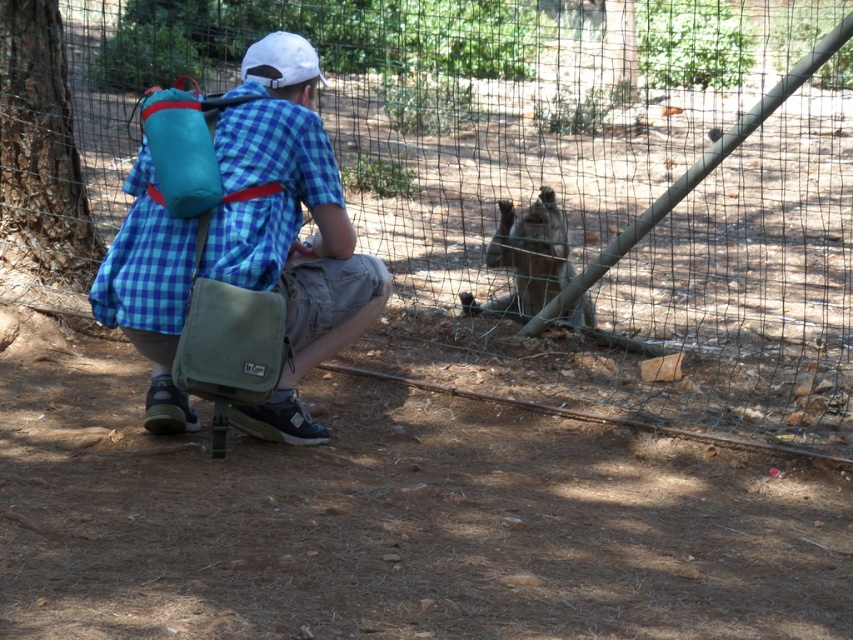
Is green mesh fence at center smaller than green canvas bag at center?

No, green mesh fence at center is not smaller than green canvas bag at center.

This screenshot has height=640, width=853. What do you see at coordinates (527, 179) in the screenshot?
I see `green mesh fence at center` at bounding box center [527, 179].

The height and width of the screenshot is (640, 853). What are the coordinates of `green mesh fence at center` in the screenshot? It's located at (527, 179).

Who is shorter, brown furry monkey at center or teal fabric backpack at upper left?

With less height is teal fabric backpack at upper left.

Measure the distance between point (x=576, y=316) and camera.

Point (x=576, y=316) and camera are 19.39 feet apart from each other.

Where is `brown furry monkey at center`? brown furry monkey at center is located at coordinates (527, 257).

Who is more distant from viewer, (281,292) or (207,166)?

The point (281,292) is behind.

Looking at this image, is green canvas bag at center smaller than teal fabric backpack at upper left?

No.

Is point (296, 60) closer to viewer compared to point (177, 83)?

Yes.

What are the coordinates of `green canvas bag at center` in the screenshot? It's located at (238, 250).